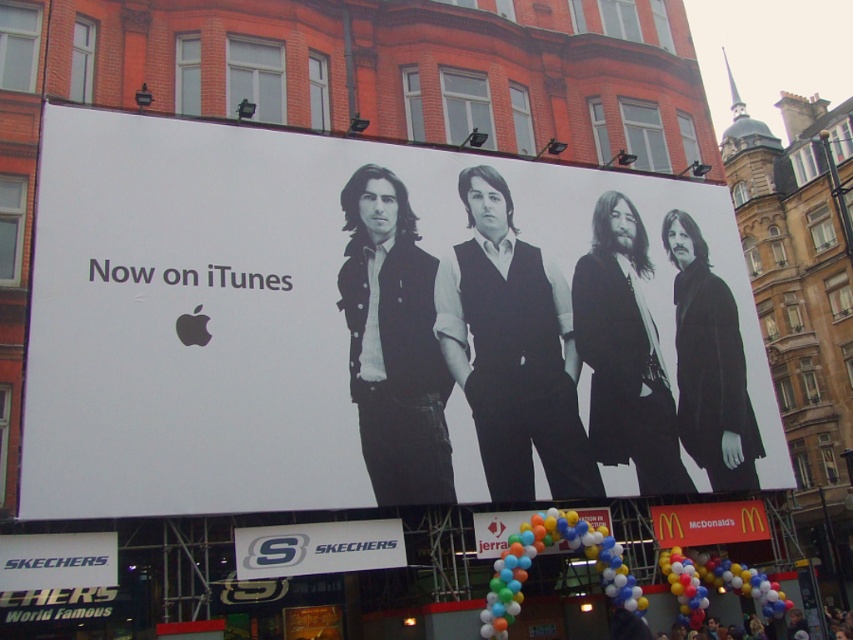
You are a photographer trying to capture the balloon bouquet at lower center without the white paper billboard at center blocking the view. Is this possible?

The white paper billboard at center is in front of balloon bouquet at lower center, so it will block the view. You cannot capture the balloon bouquet at lower center without the billboard obstructing it.

You are standing at the entrance of the building and want to take a photo of the white paper billboard at center. If your camera can focus up to 100 feet away, will you need to adjust your position to capture a clear image?

The white paper billboard at center is 106.27 feet away from the camera, which exceeds the camera focus limit of 100 feet. You need to move closer to ensure the white paper billboard at center is within the focus range.